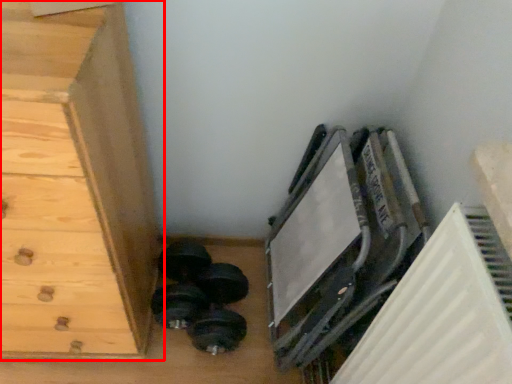
Question: From the image, what is the correct spatial relationship of chest of drawers (annotated by the red box) in relation to dumbbell?

Choices:
 (A) left
 (B) right

Answer: (A)